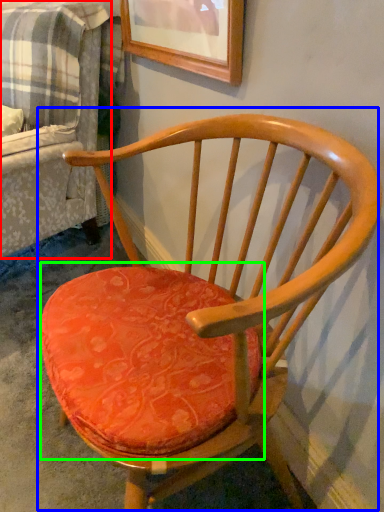
Question: Which object is positioned closest to couch (highlighted by a red box)? Select from chair (highlighted by a blue box) and table (highlighted by a green box).

Choices:
 (A) chair
 (B) table

Answer: (A)